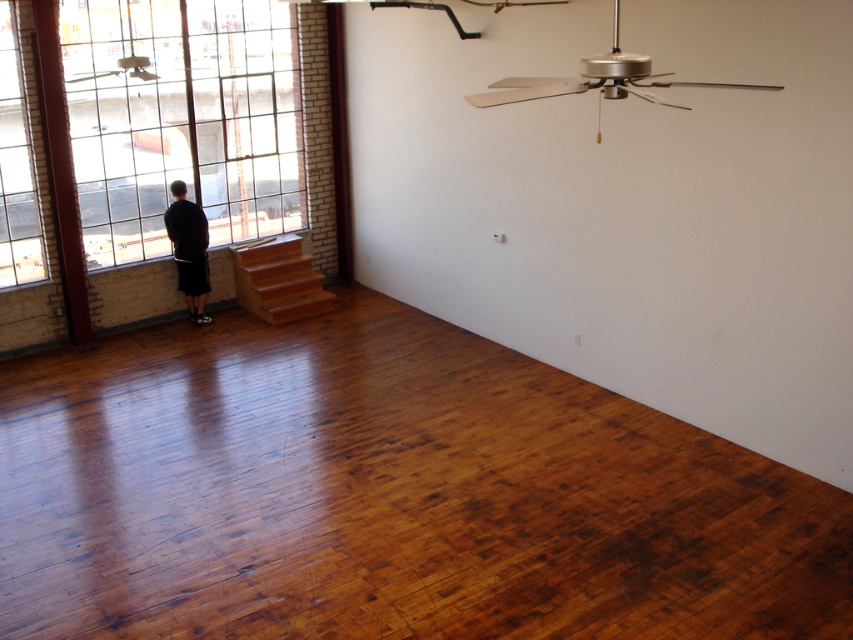
You are trying to decide where to place a new rug in the room. The rug you have is the same size as the shiny brown hardwood floor at center. Will the rug be shorter than the black matte shorts at left?

The shiny brown hardwood floor at center is shorter than the black matte shorts at left. Therefore, the rug, being the same size as the shiny brown hardwood floor at center, will also be shorter than the black matte shorts at left.

You are standing at the point labeled point [16,166] in the room. What object is directly in front of you?

The clear glass window at left is directly in front of you at point [16,166].

You are a delivery person carrying a heavy box and need to place it on the floor. The shiny brown hardwood floor at center is under the black matte shorts at left. Which object should you avoid stepping on to prevent scratching the floor?

You should avoid stepping on the shiny brown hardwood floor at center because it is under the black matte shorts at left and might be more delicate or prone to scratches from heavy items.